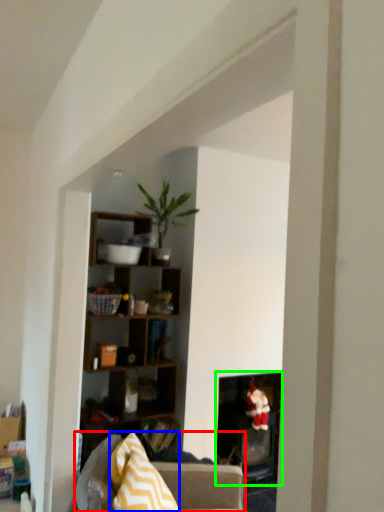
Question: Which object is positioned farthest from studio couch (highlighted by a red box)? Select from pillow (highlighted by a blue box) and fireplace (highlighted by a green box).

Choices:
 (A) pillow
 (B) fireplace

Answer: (B)